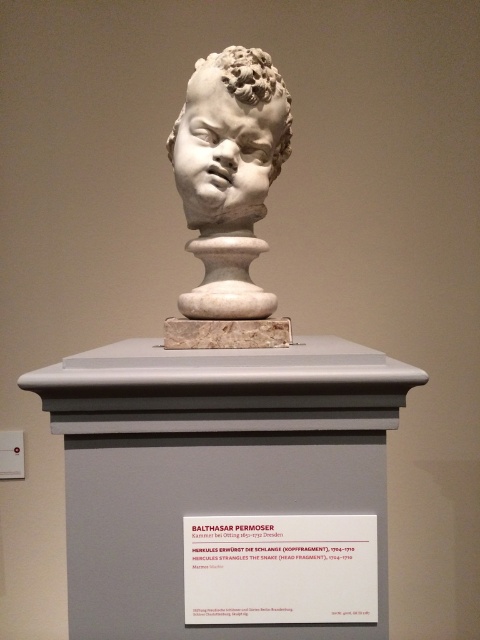
From the picture: Which of these two, white marble bust at center or white marble head at center, stands taller?

white marble bust at center is taller.

What do you see at coordinates (228, 195) in the screenshot?
I see `white marble bust at center` at bounding box center [228, 195].

What are the coordinates of `white marble bust at center` in the screenshot? It's located at (228, 195).